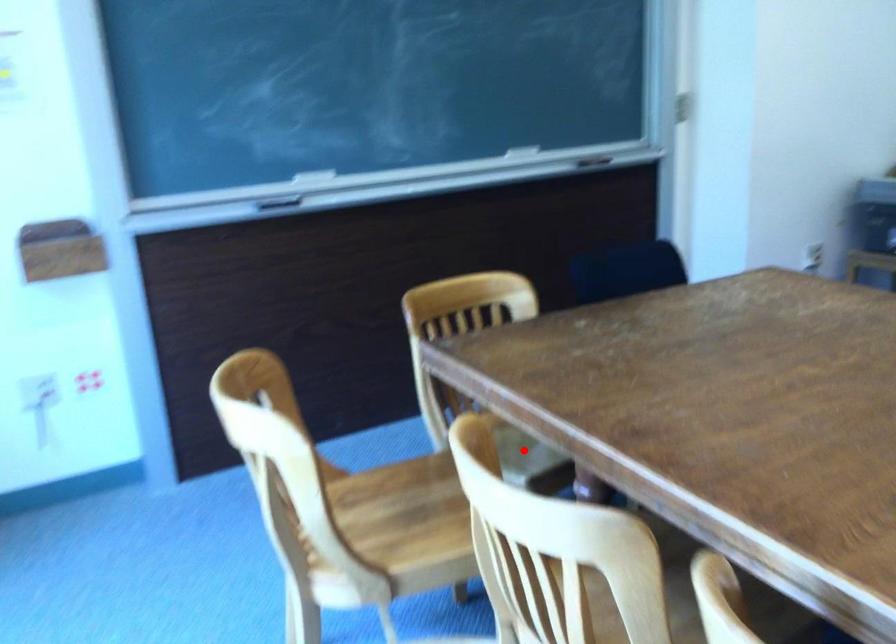
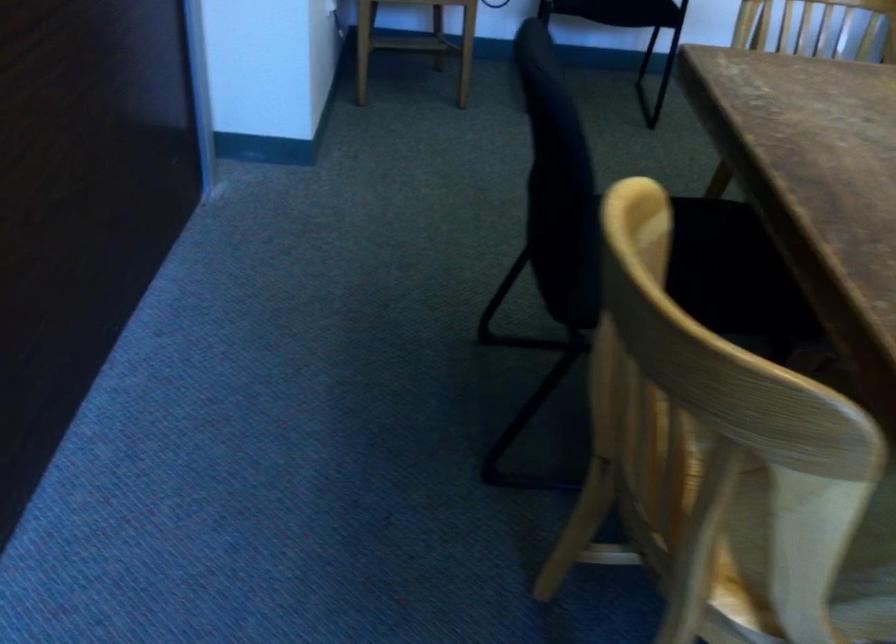
The point at the highlighted location is marked in the first image. Where is the corresponding point in the second image?

(872, 538)